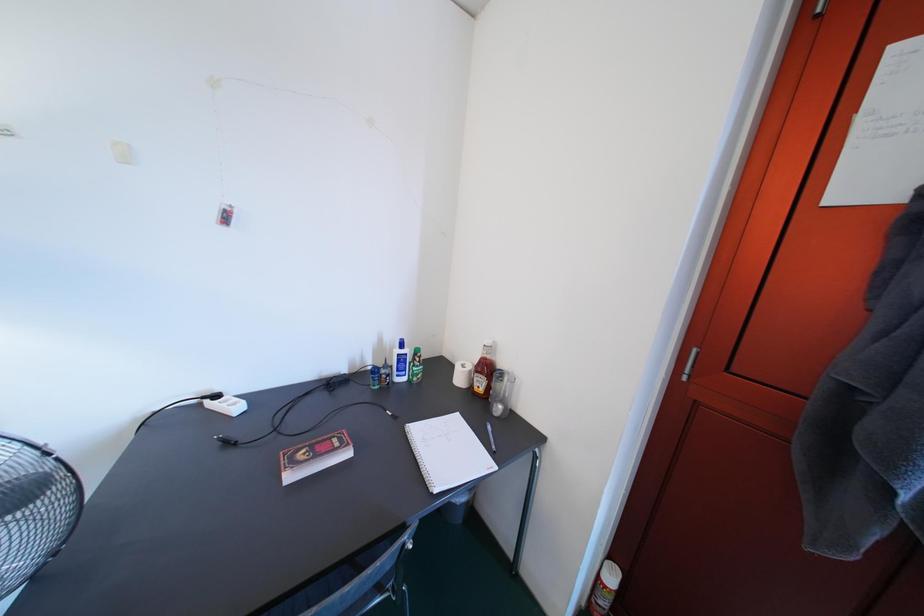
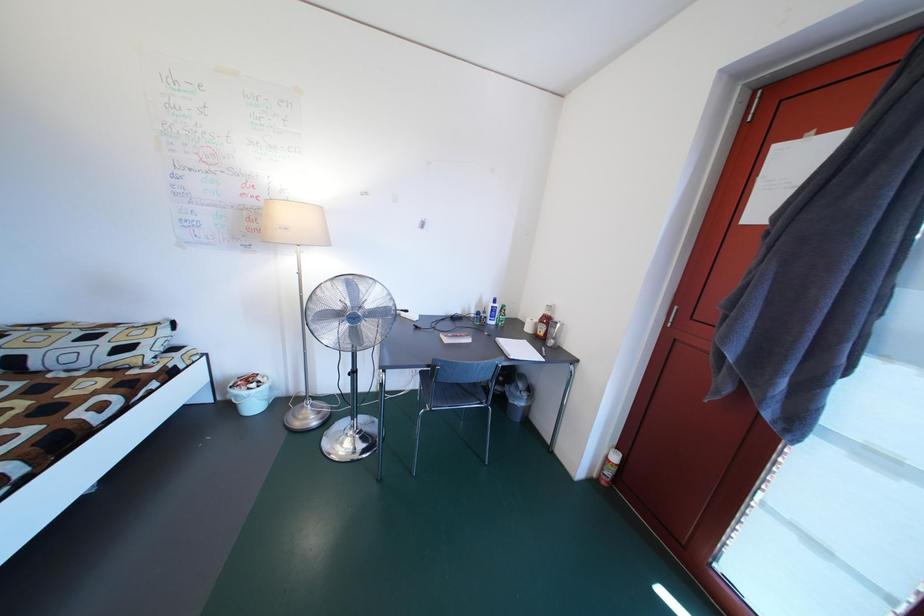
Question: Which direction would the cameraman need to move to produce the second image? Reply with the corresponding letter.

Choices:
 (A) Left
 (B) Right
 (C) Forward
 (D) Backward

Answer: (D)